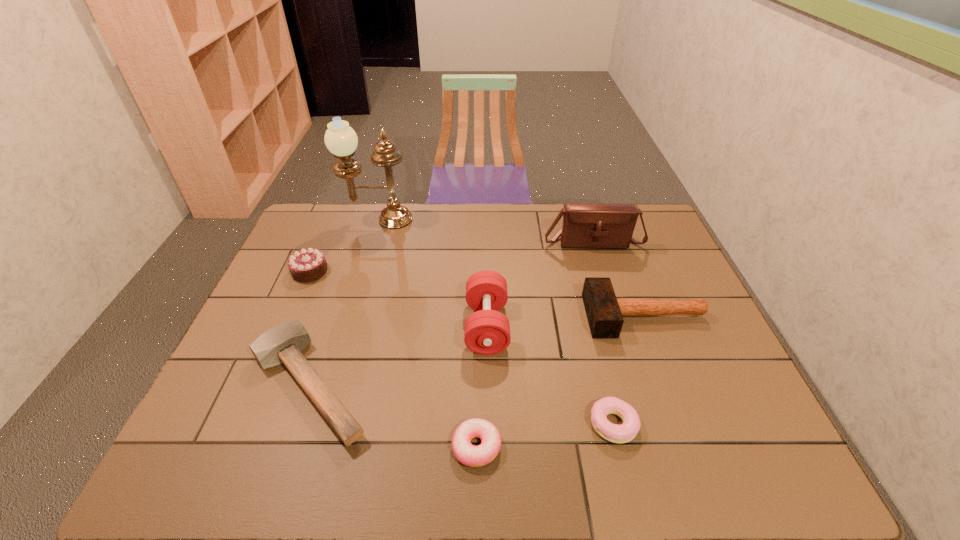
Find the location of `blank region between the right doughnut and the left mallet`. blank region between the right doughnut and the left mallet is located at coordinates (462, 404).

This screenshot has width=960, height=540. Identify the location of vacant region between the tallest object and the left doughnut. (427, 333).

Locate an element on the screen. The image size is (960, 540). free point between the dumbbell and the second farthest object is located at coordinates point(540,284).

Locate an element on the screen. free space between the left mallet and the right doughnut is located at coordinates (462, 404).

At what (x,y) coordinates should I click in order to perform the action: click on vacant area between the chocolate cake and the dumbbell. Please return your answer as a coordinate pair (x, y). Image resolution: width=960 pixels, height=540 pixels. Looking at the image, I should click on (398, 299).

This screenshot has height=540, width=960. What are the coordinates of `vacant space that's between the sixth nearest object and the farthest object` in the screenshot? It's located at (344, 245).

Where is `object identified as the seventh closest to the farthest object`? The image size is (960, 540). object identified as the seventh closest to the farthest object is located at coordinates (615, 433).

Locate an element on the screen. This screenshot has height=540, width=960. object that stands as the fifth closest to the third farthest object is located at coordinates (585, 225).

In order to click on free location that satisfies the following two spatial constraints: 1. on the front side of the right doughnut; 2. on the left side of the chocolate cake in this screenshot , I will do `click(243, 424)`.

Identify the location of vacant area in the image that satisfies the following two spatial constraints: 1. on the hammer head face of the right mallet; 2. on the front side of the right doughnut. The height and width of the screenshot is (540, 960). (685, 424).